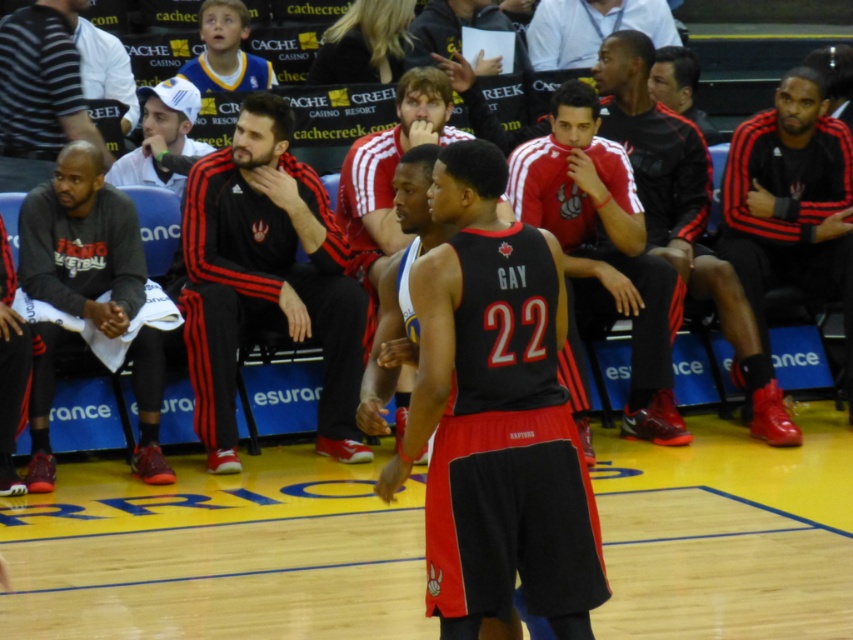
Does black jersey at center appear under white shirt at upper center?

Indeed, black jersey at center is positioned under white shirt at upper center.

Which of these two, black jersey at center or white shirt at upper center, stands shorter?

With less height is white shirt at upper center.

This screenshot has height=640, width=853. I want to click on black jersey at center, so click(x=496, y=416).

Who is positioned more to the right, black leather jacket at center or dark gray striped shirt at left?

From the viewer's perspective, black leather jacket at center appears more on the right side.

What do you see at coordinates (683, 212) in the screenshot?
I see `black leather jacket at center` at bounding box center [683, 212].

Is point (705, 218) positioned after point (27, 161)?

Yes, it is.

Image resolution: width=853 pixels, height=640 pixels. Identify the location of black leather jacket at center. (683, 212).

Is dark gray striped shirt at left smaller than white shirt at upper center?

No, dark gray striped shirt at left is not smaller than white shirt at upper center.

Who is more distant from viewer, (55, 86) or (579, 24)?

Positioned behind is point (579, 24).

At what (x,y) coordinates should I click in order to perform the action: click on dark gray striped shirt at left. Please return your answer as a coordinate pair (x, y). This screenshot has height=640, width=853. Looking at the image, I should click on (39, 93).